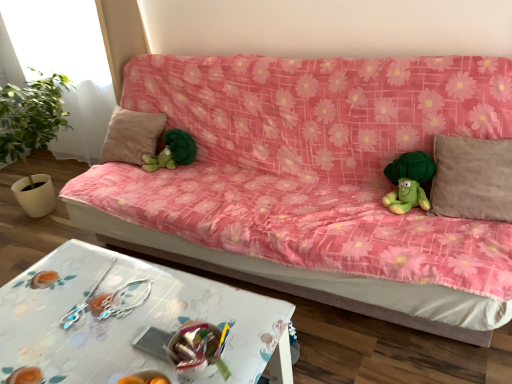
In order to click on vacant point above white glossy table at lower center (from a real-world perspective) in this screenshot , I will do `click(103, 316)`.